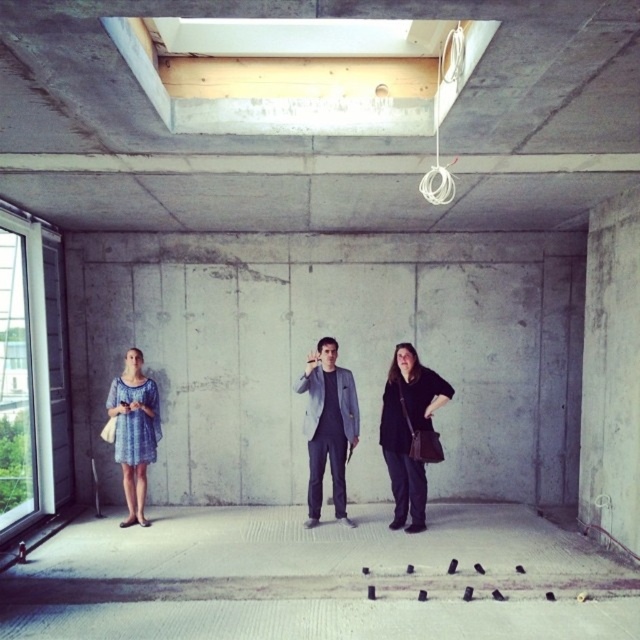
Question: Which object is farther from the camera taking this photo?

Choices:
 (A) blue printed dress at left
 (B) black leather jacket at lower right
 (C) gray fabric suit at center

Answer: (A)

Question: Where is black leather jacket at lower right located in relation to blue printed dress at left in the image?

Choices:
 (A) above
 (B) below

Answer: (A)

Question: Which point is closer to the camera taking this photo?

Choices:
 (A) (394, 408)
 (B) (134, 483)
 (C) (323, 416)

Answer: (A)

Question: Which object is farther from the camera taking this photo?

Choices:
 (A) black leather jacket at lower right
 (B) gray fabric suit at center
 (C) blue printed dress at left

Answer: (C)

Question: From the image, what is the correct spatial relationship of gray fabric suit at center in relation to blue printed dress at left?

Choices:
 (A) above
 (B) below

Answer: (A)

Question: Where is black leather jacket at lower right located in relation to gray fabric suit at center in the image?

Choices:
 (A) right
 (B) left

Answer: (A)